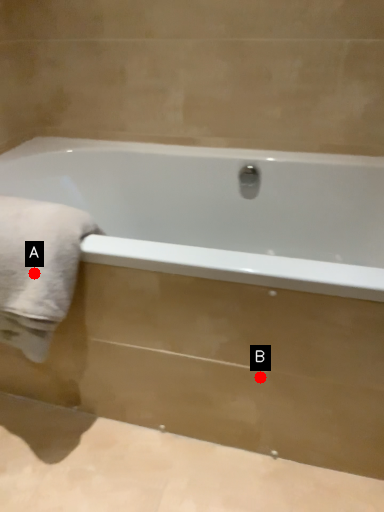
Question: Two points are circled on the image, labeled by A and B beside each circle. Which of the following is the closest to the observer?

Choices:
 (A) A is closer
 (B) B is closer

Answer: (A)